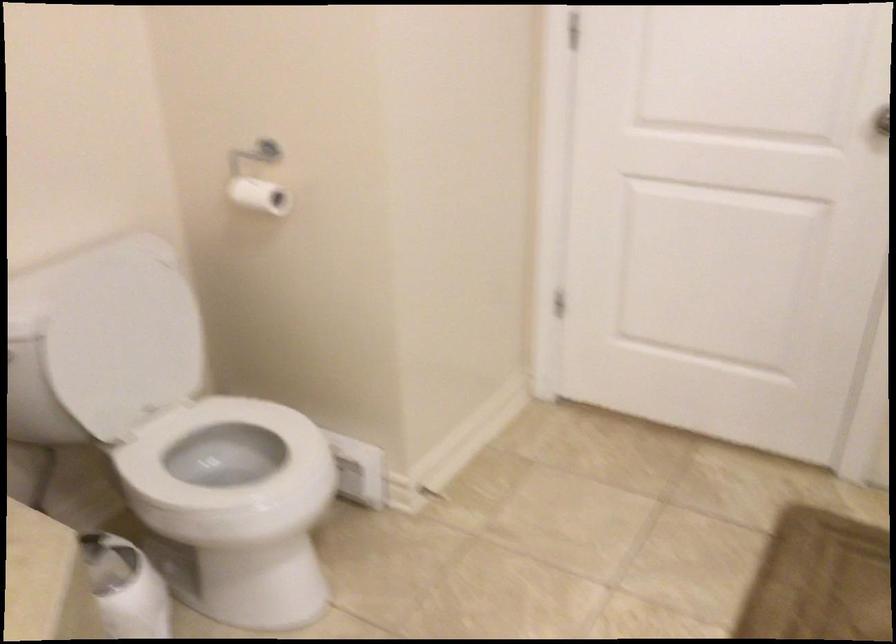
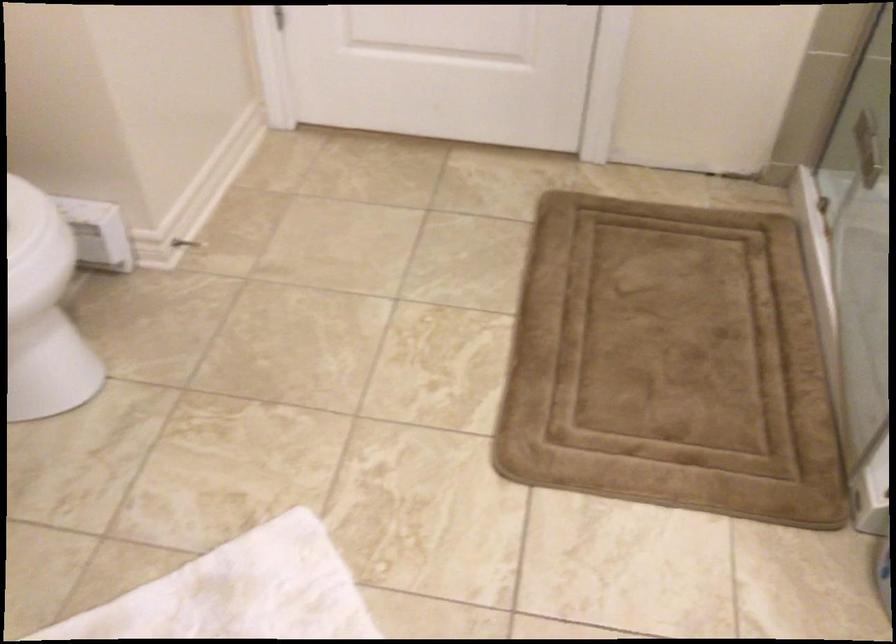
From the picture: In a continuous first-person perspective shot, in which direction is the camera moving?

The movement direction of the cameraman is left, forward.